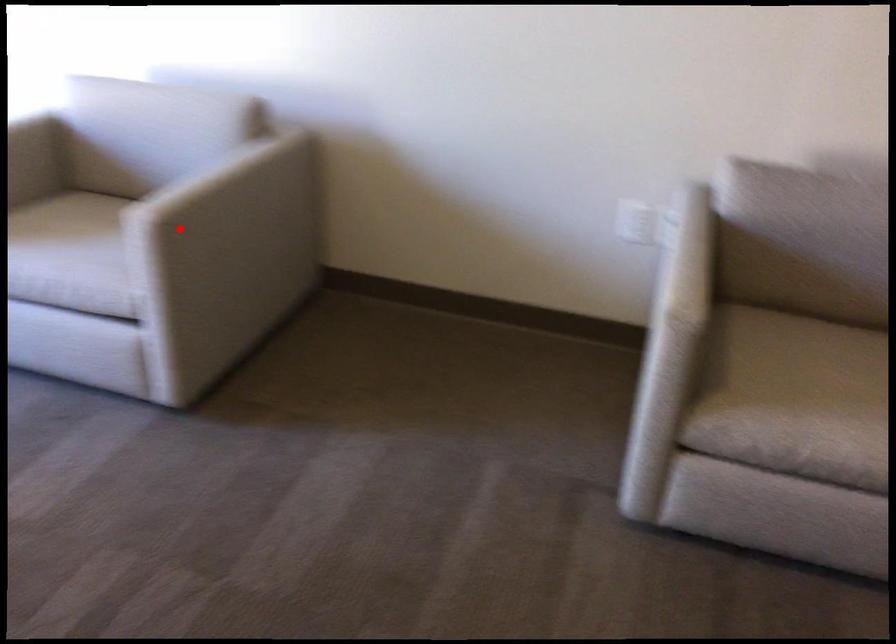
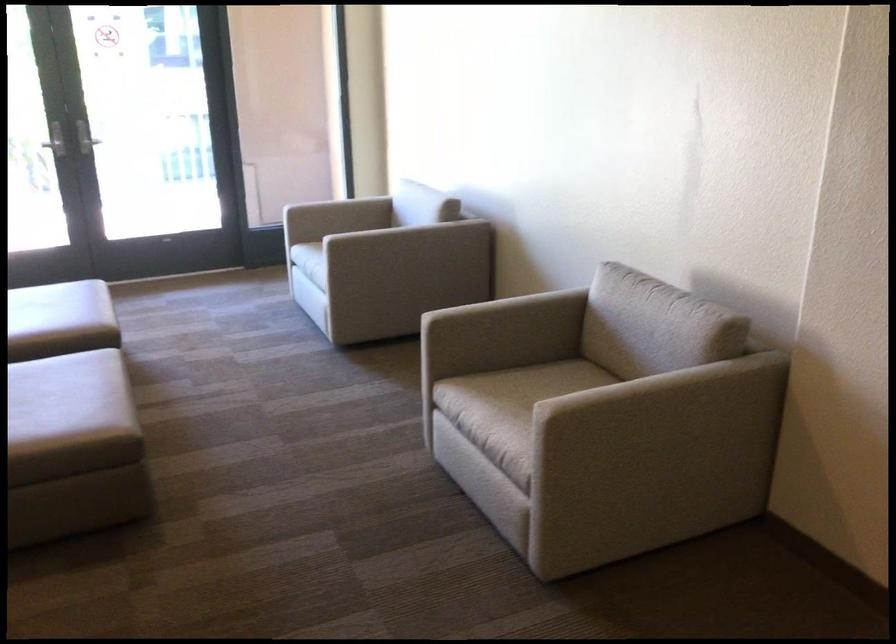
Question: I am providing you with two images of the same scene from different viewpoints. In image1, a red point is highlighted. Considering the same 3D point in image2, which of the following is correct?

Choices:
 (A) It is closer
 (B) It is farther

Answer: (B)